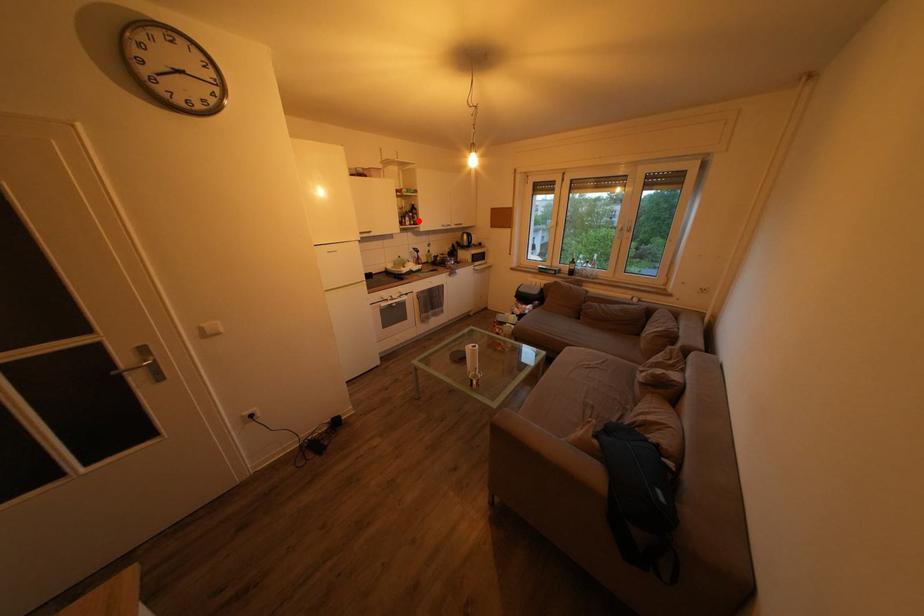
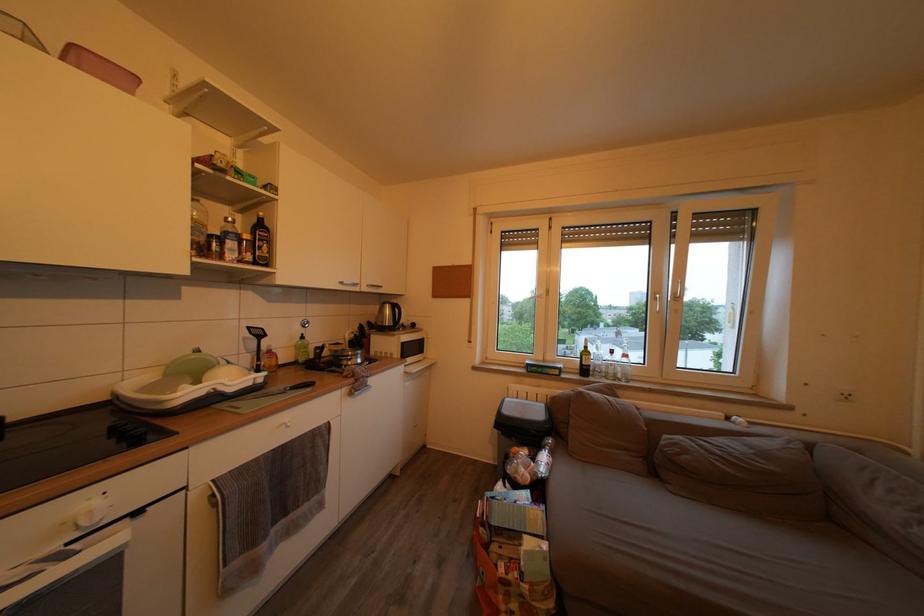
Locate, in the second image, the point that corresponds to the highlighted location in the first image.

(253, 243)